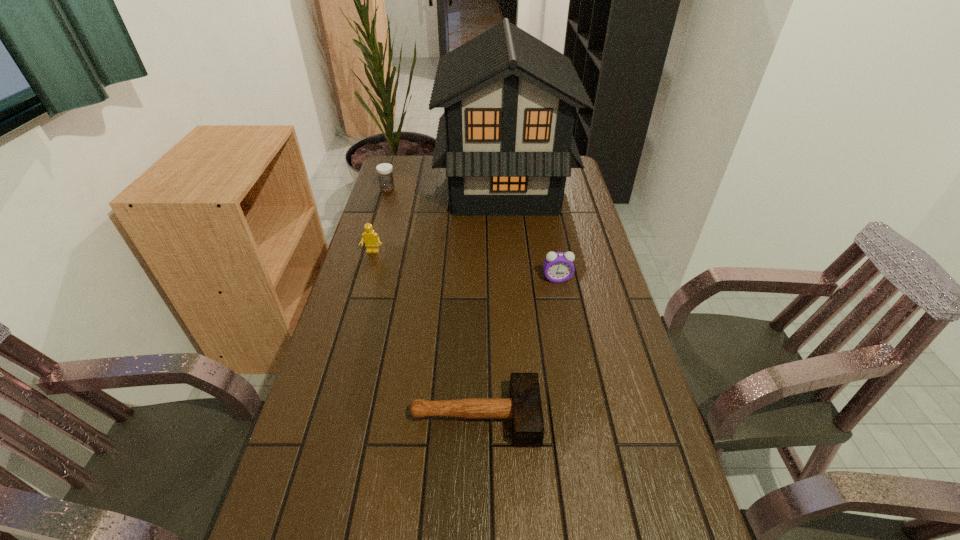
This screenshot has height=540, width=960. In the image, there is a desktop. Find the location of `free space at the right edge`. free space at the right edge is located at coordinates (639, 387).

Identify the location of vacant space that is in between the mallet and the third nearest object. This screenshot has width=960, height=540. (424, 334).

The width and height of the screenshot is (960, 540). In order to click on vacant space that's between the medicine and the third nearest object in this screenshot , I will do `click(380, 221)`.

Image resolution: width=960 pixels, height=540 pixels. In order to click on free point between the tallest object and the mallet in this screenshot , I will do `click(490, 301)`.

The image size is (960, 540). What are the coordinates of `free space between the medicine and the nearest object` in the screenshot? It's located at (431, 303).

Where is `empty space between the nearest object and the medicine`? The height and width of the screenshot is (540, 960). empty space between the nearest object and the medicine is located at coordinates (431, 303).

Where is `vacant area that lies between the dollhouse and the third farthest object`? The height and width of the screenshot is (540, 960). vacant area that lies between the dollhouse and the third farthest object is located at coordinates (438, 219).

The height and width of the screenshot is (540, 960). I want to click on free spot between the Lego and the tallest object, so click(438, 219).

Identify the location of vacant space that is in between the medicine and the third nearest object. This screenshot has width=960, height=540. (380, 221).

What are the coordinates of `object that ranks as the closest to the mallet` in the screenshot? It's located at (558, 266).